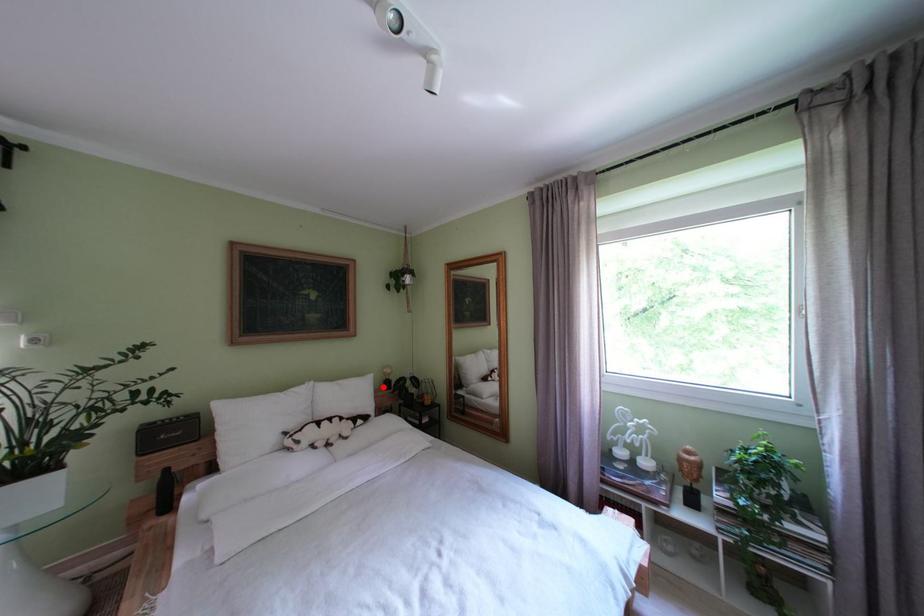
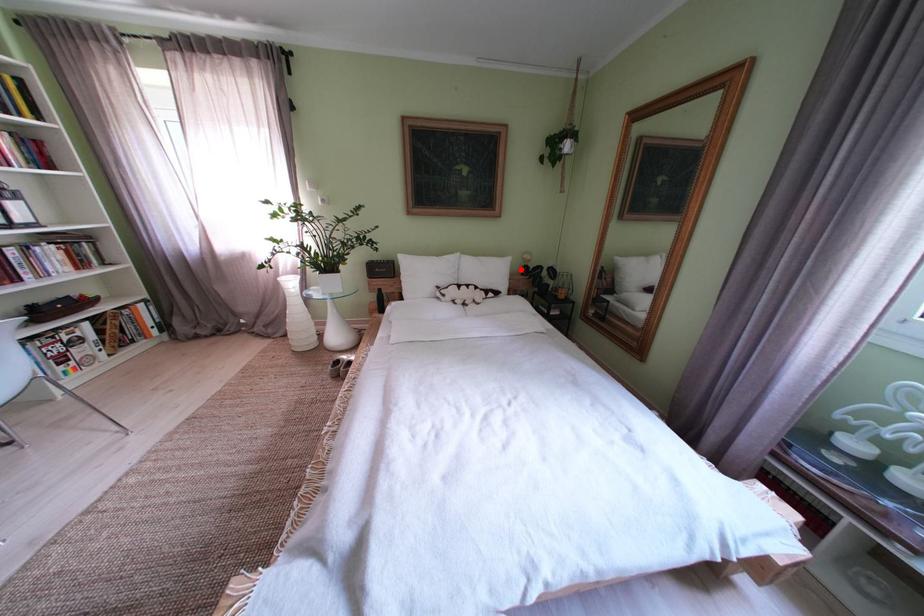
I am providing you with two images of the same scene from different viewpoints. A red point is marked on the first image and another point is marked on the second image. Is the marked point in image1 the same physical position as the marked point in image2?

Yes